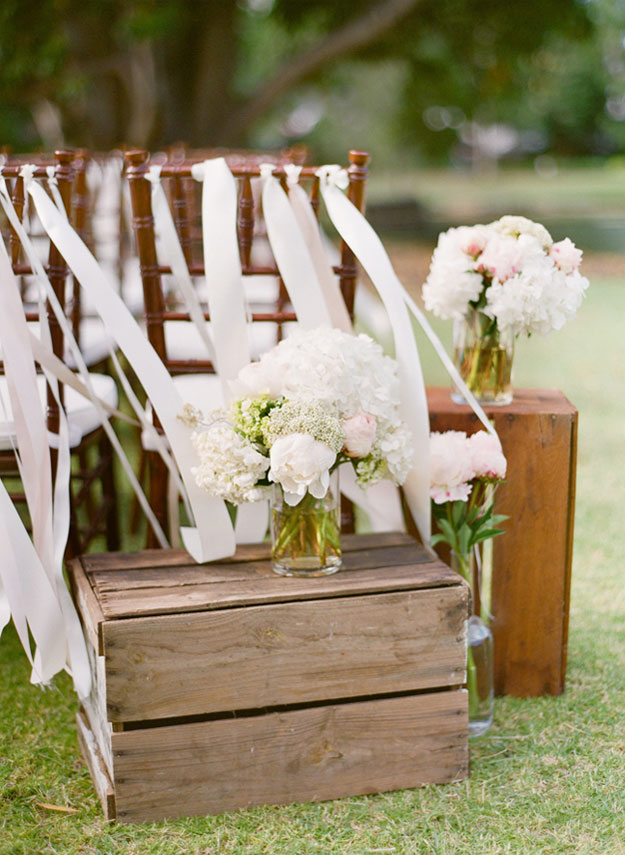
The width and height of the screenshot is (625, 855). What are the coordinates of `box` in the screenshot? It's located at (394, 616), (522, 549).